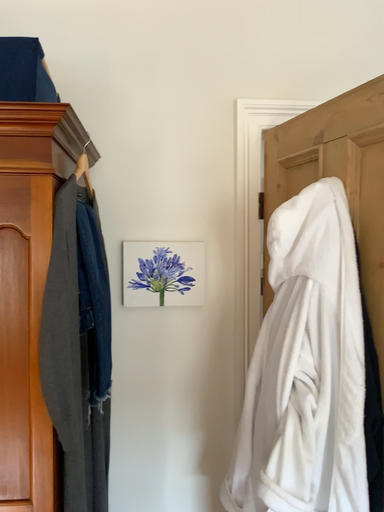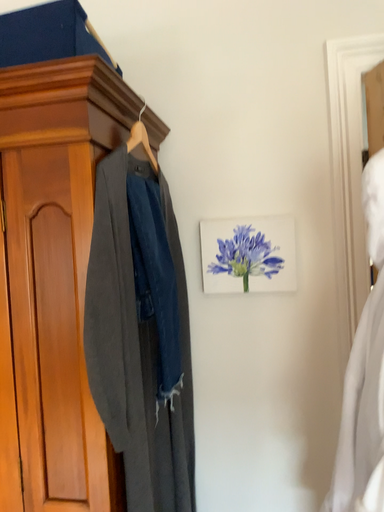
Question: How did the camera likely rotate when shooting the video?

Choices:
 (A) rotated left
 (B) rotated right

Answer: (A)